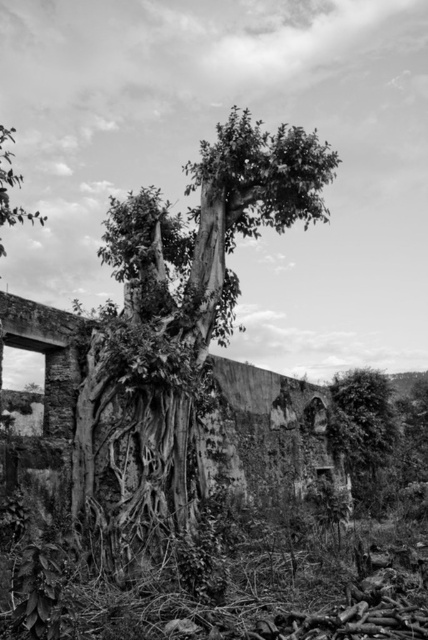
Question: Among these objects, which one is farthest from the camera?

Choices:
 (A) thick textured foliage at right
 (B) textured bark tree at center

Answer: (A)

Question: Among these objects, which one is nearest to the camera?

Choices:
 (A) thick textured foliage at right
 (B) textured bark tree at center

Answer: (B)

Question: Does textured bark tree at center come behind thick textured foliage at right?

Choices:
 (A) yes
 (B) no

Answer: (B)

Question: Is textured bark tree at center to the right of thick textured foliage at right from the viewer's perspective?

Choices:
 (A) yes
 (B) no

Answer: (B)

Question: Is textured bark tree at center above thick textured foliage at right?

Choices:
 (A) yes
 (B) no

Answer: (A)

Question: Which point appears farthest from the camera in this image?

Choices:
 (A) (377, 467)
 (B) (127, 500)

Answer: (A)